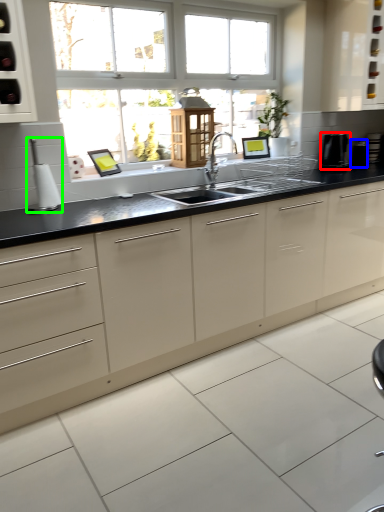
Question: Which object is positioned closest to appliance (highlighted by a red box)? Select from appliance (highlighted by a blue box) and appliance (highlighted by a green box).

Choices:
 (A) appliance
 (B) appliance

Answer: (A)